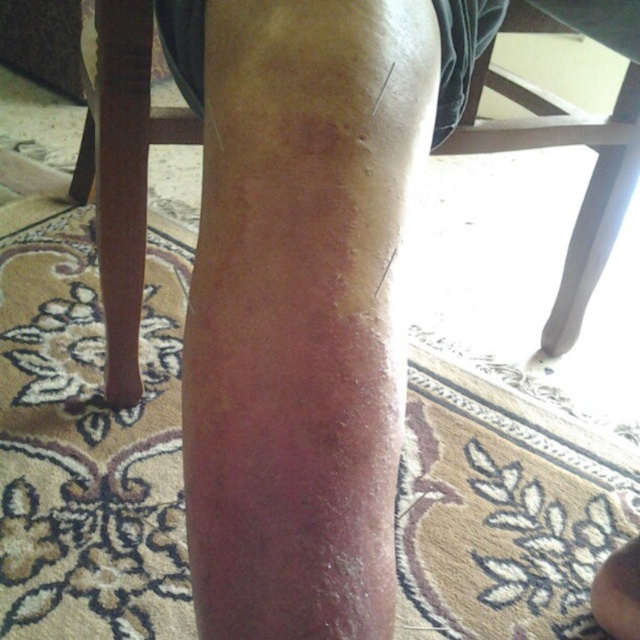
Between brown wood chair at center and smooth skin at lower right, which one has more height?

brown wood chair at center is taller.

Is brown wood chair at center closer to the viewer compared to smooth skin at lower right?

Yes, it is in front of smooth skin at lower right.

Who is more forward, (321, 19) or (616, 595)?

Point (321, 19) is in front.

At what (x,y) coordinates should I click in order to perform the action: click on brown wood chair at center. Please return your answer as a coordinate pair (x, y). Looking at the image, I should click on (301, 186).

Who is shorter, dry skin at center or smooth skin at lower right?

With less height is smooth skin at lower right.

Does dry skin at center have a smaller size compared to smooth skin at lower right?

No.

Which is behind, point (296, 568) or point (618, 612)?

The point (618, 612) is behind.

The image size is (640, 640). What are the coordinates of `dry skin at center` in the screenshot? It's located at (300, 312).

Is dry skin at center further to camera compared to brown wood chair at center?

No.

Based on the photo, does dry skin at center have a lesser height compared to brown wood chair at center?

Correct, dry skin at center is not as tall as brown wood chair at center.

What do you see at coordinates (300, 312) in the screenshot?
I see `dry skin at center` at bounding box center [300, 312].

The image size is (640, 640). Identify the location of dry skin at center. (300, 312).